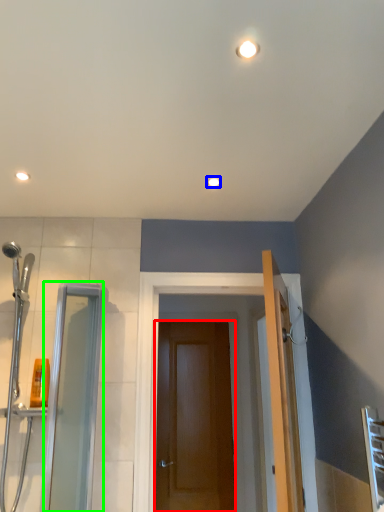
Question: Which is farther away from door (highlighted by a red box)? light fixture (highlighted by a blue box) or screen door (highlighted by a green box)?

Choices:
 (A) light fixture
 (B) screen door

Answer: (A)